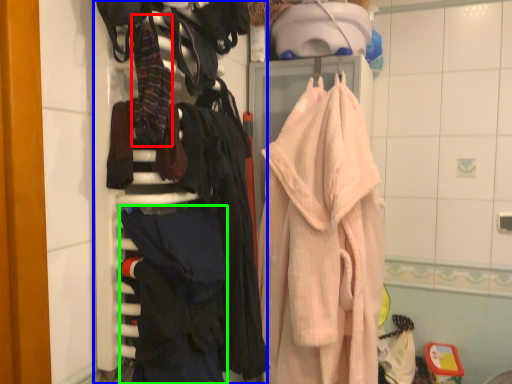
Question: Which object is positioned farthest from clothing (highlighted by a red box)? Select from closet (highlighted by a blue box) and clothing (highlighted by a green box).

Choices:
 (A) closet
 (B) clothing

Answer: (B)